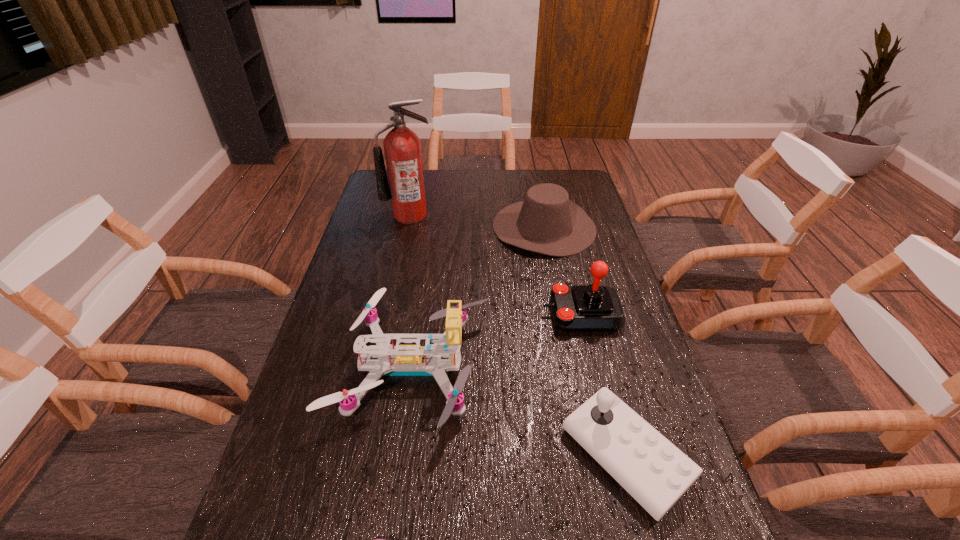
Locate an element on the screen. The width and height of the screenshot is (960, 540). free space between the nearer joystick and the fire extinguisher is located at coordinates (517, 335).

Find the location of a particular element. The height and width of the screenshot is (540, 960). vacant region between the tallest object and the taller joystick is located at coordinates (495, 265).

The image size is (960, 540). I want to click on vacant space in between the cowboy hat and the drone, so click(x=478, y=297).

You are a GUI agent. You are given a task and a screenshot of the screen. Output one action in this format:
    pyautogui.click(x=<x>, y=<y>)
    Task: Click on the free spot between the cowboy hat and the farther joystick
    This screenshot has width=960, height=540.
    Given the screenshot: What is the action you would take?
    click(563, 270)

Identify which object is the fourth closest to the cowboy hat. Please provide its 2D coordinates. Your answer should be formatted as a tuple, i.e. [(x, y)], where the tuple contains the x and y coordinates of a point satisfying the conditions above.

[(647, 465)]

Locate an element on the screen. Image resolution: width=960 pixels, height=540 pixels. the third closest object relative to the nearest object is located at coordinates (583, 308).

You are a GUI agent. You are given a task and a screenshot of the screen. Output one action in this format:
    pyautogui.click(x=<x>, y=<y>)
    Task: Click on the free location that satisfies the following two spatial constraints: 1. on the base of the nearer joystick; 2. on the left side of the farther joystick
    
    Given the screenshot: What is the action you would take?
    pyautogui.click(x=615, y=455)

Where is `vacant area that satisfies the following two spatial constraints: 1. on the front side of the cowboy hat; 2. on the front-facing side of the drone`? The height and width of the screenshot is (540, 960). vacant area that satisfies the following two spatial constraints: 1. on the front side of the cowboy hat; 2. on the front-facing side of the drone is located at coordinates (571, 368).